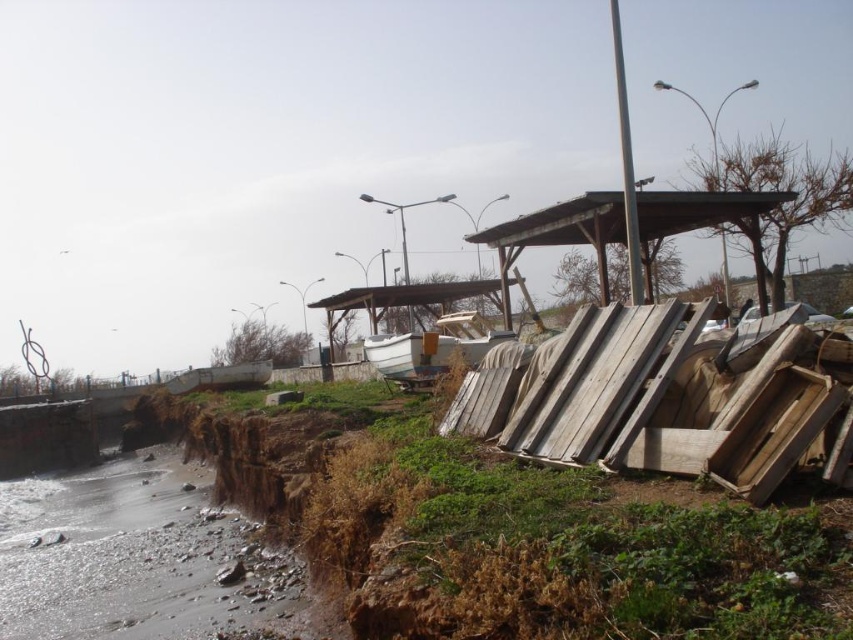
Is wooden shelter at center positioned at the back of white matte boat at center?

No, wooden shelter at center is closer to the viewer.

Is point (524, 227) more distant than point (422, 365)?

Yes, point (524, 227) is behind point (422, 365).

You are a GUI agent. You are given a task and a screenshot of the screen. Output one action in this format:
    pyautogui.click(x=<x>, y=<y>)
    Task: Click on the wooden shelter at center
    Image resolution: width=853 pixels, height=640 pixels.
    Given the screenshot: What is the action you would take?
    pyautogui.click(x=560, y=234)